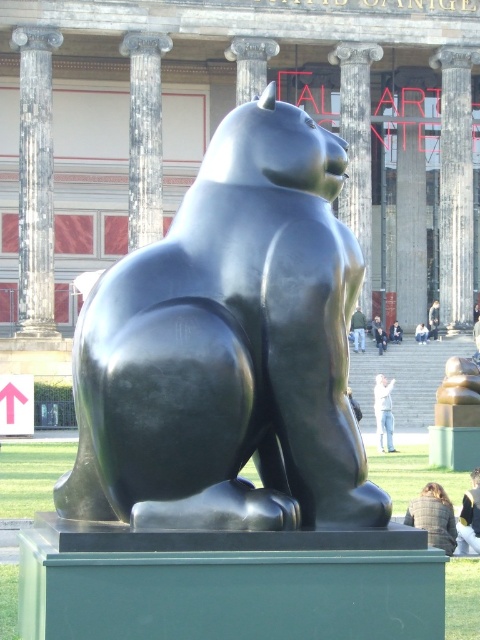
At what (x,y) coordinates should I click in order to perform the action: click on polished marble column at center. Please return your answer as a coordinate pair (x, y). Looking at the image, I should click on (144, 134).

Who is positioned more to the left, polished marble column at center or polished stone column at center?

Positioned to the left is polished marble column at center.

Locate an element on the screen. This screenshot has width=480, height=640. polished marble column at center is located at coordinates (144, 134).

Can you confirm if polished marble column at left is wider than light gray stone statue at center?

Yes.

Is polished marble column at left positioned at the back of light gray stone statue at center?

No, polished marble column at left is in front of light gray stone statue at center.

Between point (47, 150) and point (436, 333), which one is positioned behind?

The point (436, 333) is more distant.

Find the location of a particular element. This screenshot has height=640, width=480. polished marble column at left is located at coordinates (36, 180).

Which is more to the left, polished marble column at left or white cotton shirt at lower center?

Positioned to the left is polished marble column at left.

Is point (49, 131) positioned behind point (380, 353)?

No, (49, 131) is in front of (380, 353).

Does point (32, 129) come behind point (382, 336)?

No.

What are the coordinates of `polished marble column at left` in the screenshot? It's located at [36, 180].